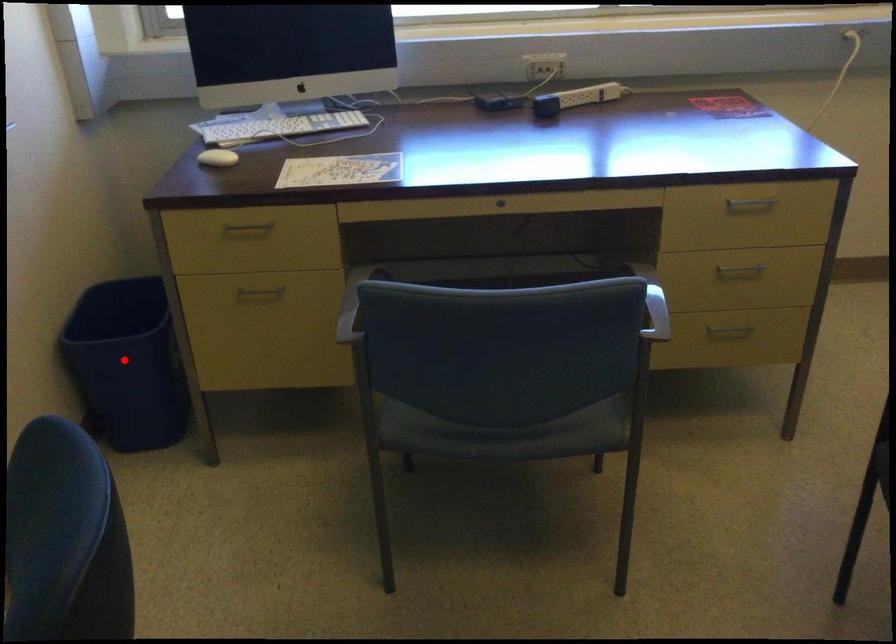
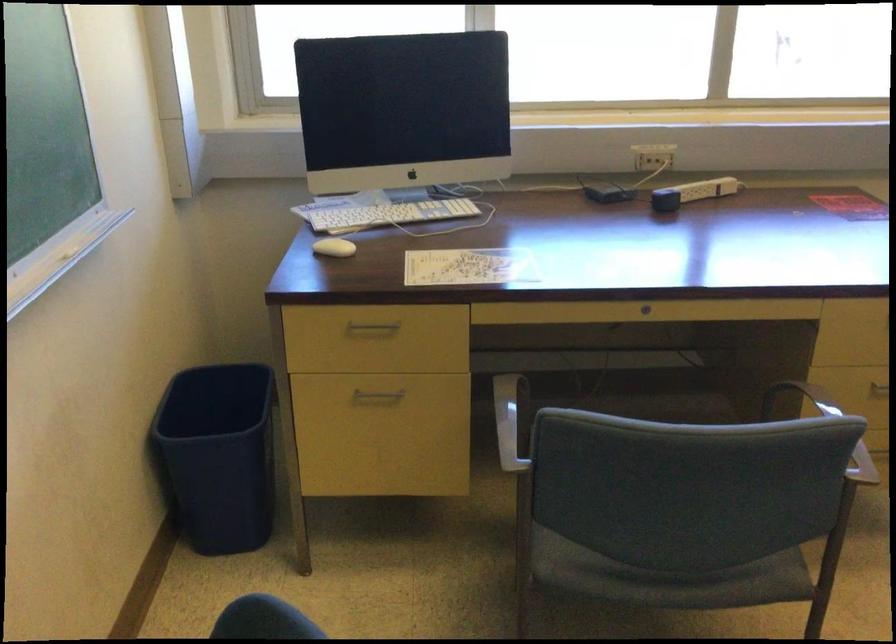
Locate, in the second image, the point that corresponds to the highlighted location in the first image.

(217, 456)